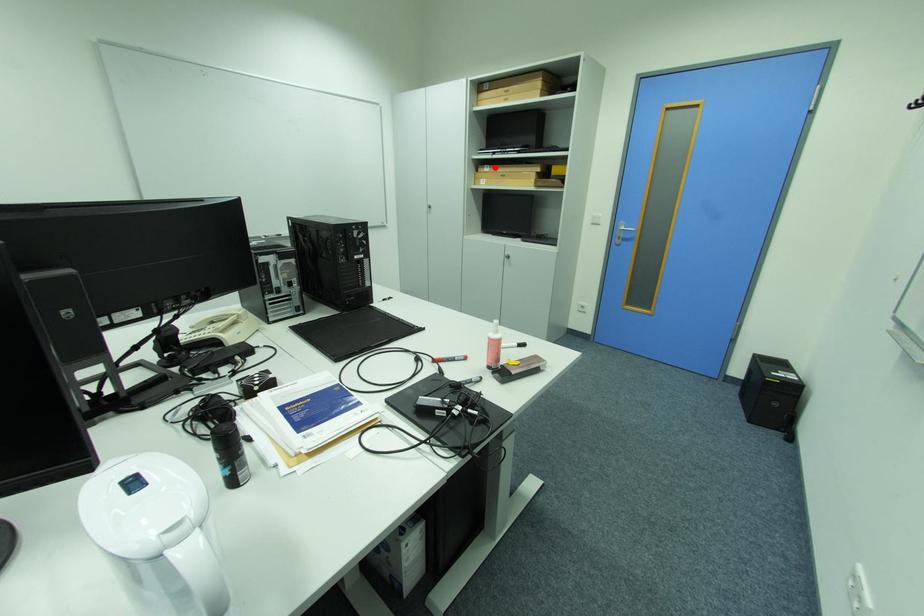
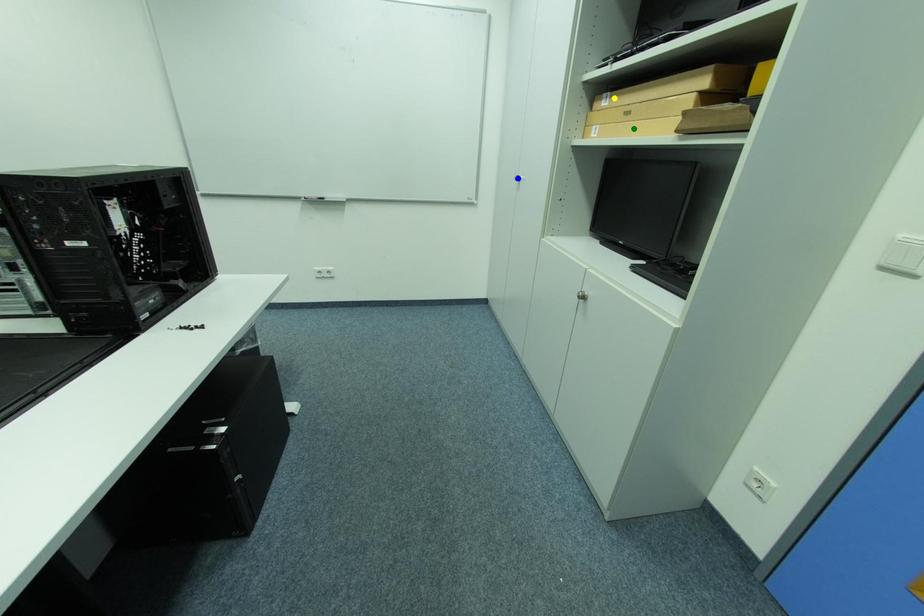
Question: I am providing you with two images of the same scene from different viewpoints. A red point is marked on the first image. You are given multiple points on the second image. Which spot in image 2 lines up with the point in image 1?

Choices:
 (A) yellow point
 (B) green point
 (C) blue point

Answer: (A)